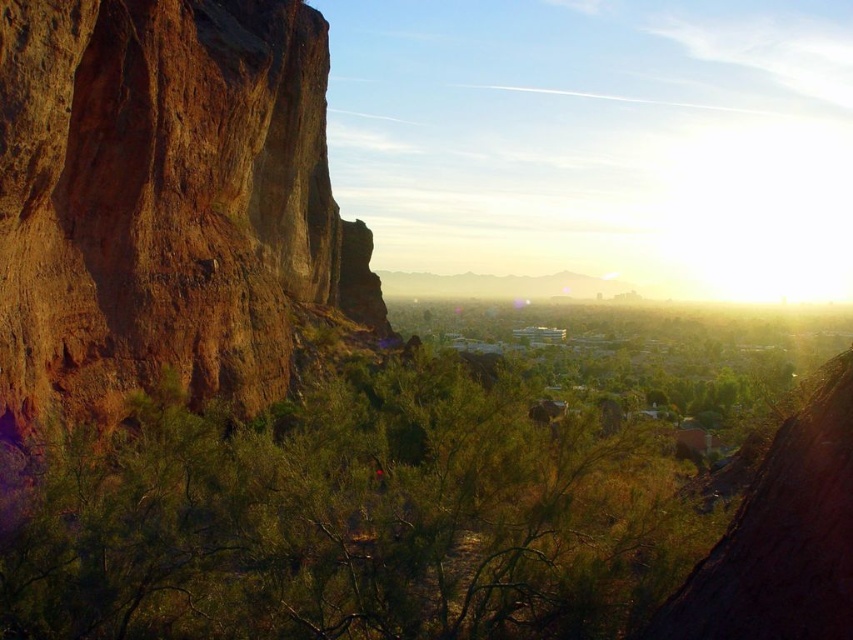
Question: Which object is closer to the camera taking this photo?

Choices:
 (A) green leafy shrub at center
 (B) brown rough rock at left

Answer: (A)

Question: Does green leafy shrub at center have a larger size compared to brown rough rock at left?

Choices:
 (A) no
 (B) yes

Answer: (A)

Question: Which of the following is the closest to the observer?

Choices:
 (A) (242, 317)
 (B) (349, 444)

Answer: (B)

Question: Does green leafy shrub at center have a smaller size compared to brown rough rock at left?

Choices:
 (A) yes
 (B) no

Answer: (A)

Question: Does green leafy shrub at center lie behind brown rough rock at left?

Choices:
 (A) yes
 (B) no

Answer: (B)

Question: Which point is farther to the camera?

Choices:
 (A) green leafy shrub at center
 (B) brown rough rock at left

Answer: (B)